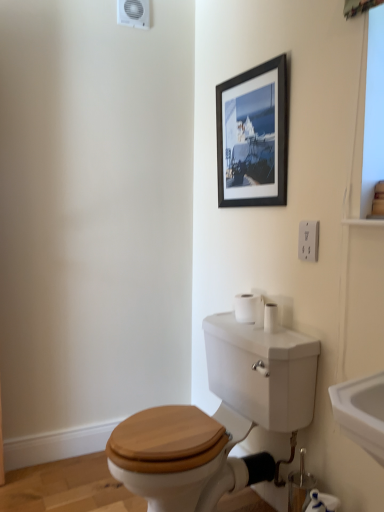
Question: In terms of height, does white matte toilet paper at lower right, arranged as the 1th toilet paper when viewed from the right, look taller or shorter compared to white matte toilet paper at right, which is the first toilet paper in back-to-front order?

Choices:
 (A) short
 (B) tall

Answer: (B)

Question: From a real-world perspective, is white matte toilet paper at lower right, the 2th toilet paper viewed from the left, above or below white matte toilet paper at right, the 2th toilet paper in the bottom-to-top sequence?

Choices:
 (A) above
 (B) below

Answer: (B)

Question: Which is farther from the black matte picture frame at upper center?

Choices:
 (A) white matte toilet paper at right, which is counted as the first toilet paper, starting from the left
 (B) white glossy sink at lower right
 (C) wooden toilet seat at center
 (D) white matte toilet paper at lower right, the 2th toilet paper viewed from the left
 (E) white plastic electrical outlet at upper right

Answer: (D)

Question: Which is farther from the white matte toilet paper at right, which is counted as the first toilet paper, starting from the left?

Choices:
 (A) black matte picture frame at upper center
 (B) white plastic electrical outlet at upper right
 (C) wooden toilet seat at center
 (D) white matte toilet paper at lower right, arranged as the 1th toilet paper when viewed from the right
 (E) white glossy sink at lower right

Answer: (A)